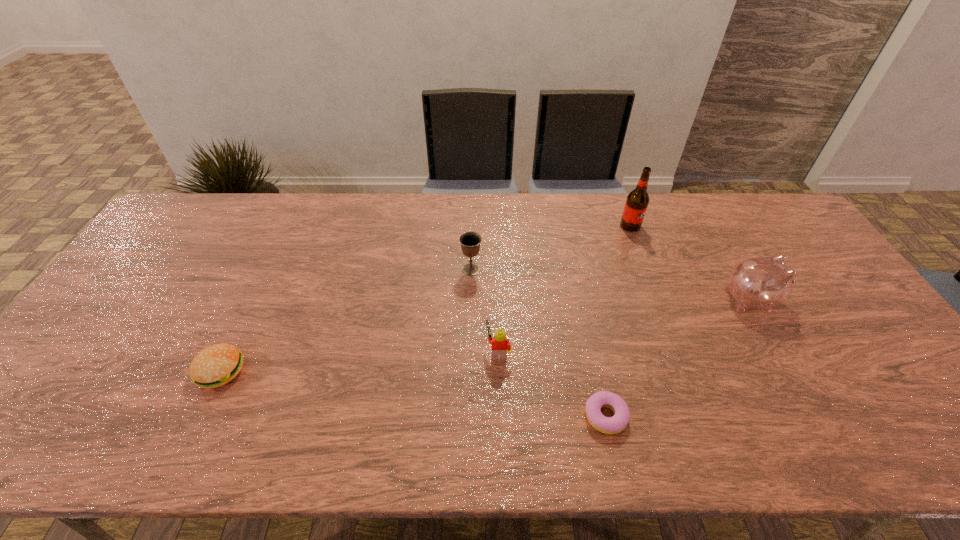
At what (x,y) coordinates should I click in order to perform the action: click on the nearest object. Please return your answer as a coordinate pair (x, y). Looking at the image, I should click on (609, 425).

Image resolution: width=960 pixels, height=540 pixels. Identify the location of doughnut. (609, 425).

Image resolution: width=960 pixels, height=540 pixels. In order to click on vacant space located 0.140m on the right of the tallest object in this screenshot , I will do `click(682, 226)`.

The height and width of the screenshot is (540, 960). Find the location of `vacant space located on the front facing side of the rightmost object`. vacant space located on the front facing side of the rightmost object is located at coordinates (811, 300).

Where is `vacant space situated on the left of the chalice`? vacant space situated on the left of the chalice is located at coordinates (391, 269).

Locate an element on the screen. Image resolution: width=960 pixels, height=540 pixels. vacant space located 0.190m in front of the Lego with the accessory visible is located at coordinates (412, 350).

This screenshot has height=540, width=960. Identify the location of vacant space located 0.110m in front of the Lego with the accessory visible. (443, 350).

At what (x,y) coordinates should I click in order to perform the action: click on free region located 0.100m in front of the Lego with the accessory visible. Please return your answer as a coordinate pair (x, y). This screenshot has height=540, width=960. Looking at the image, I should click on (446, 350).

This screenshot has height=540, width=960. I want to click on vacant point located on the right of the patty, so click(x=395, y=371).

Find the location of a particular element. vacant space situated 0.290m on the right of the shortest object is located at coordinates (755, 416).